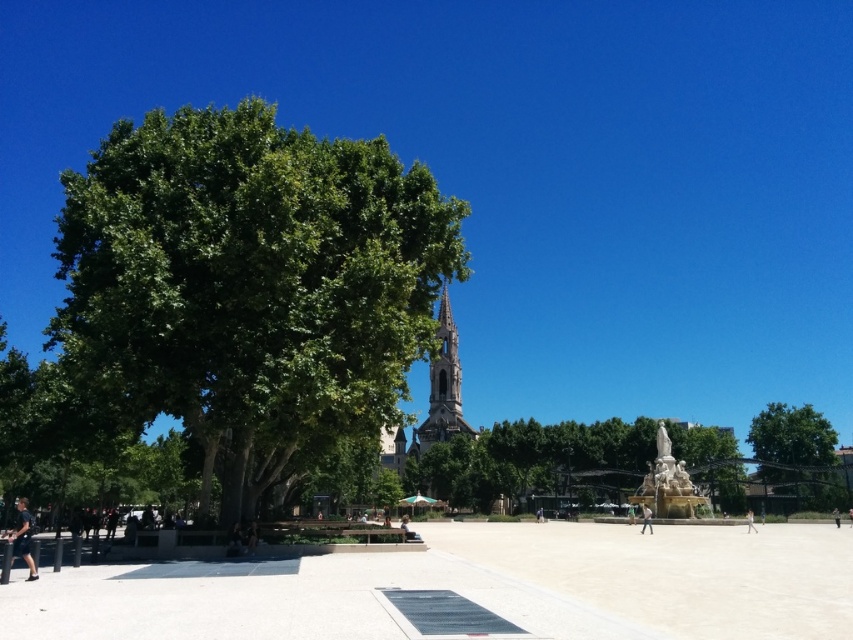
Question: Does green leafy tree at left appear on the left side of smooth stone tower at center?

Choices:
 (A) yes
 (B) no

Answer: (A)

Question: From the image, what is the correct spatial relationship of green leafy tree at center in relation to light brown wooden bench at center?

Choices:
 (A) left
 (B) right

Answer: (A)

Question: Can you confirm if green leafy tree at center is positioned to the right of camouflage fabric person at center?

Choices:
 (A) no
 (B) yes

Answer: (A)

Question: Which point is closer to the camera taking this photo?

Choices:
 (A) (840, 493)
 (B) (254, 538)

Answer: (B)

Question: Which object is farther from the camera taking this photo?

Choices:
 (A) green leafy tree at right
 (B) green leafy tree at center
 (C) smooth stone tower at center
 (D) green leafy tree at left

Answer: (A)

Question: Among these objects, which one is farthest from the camera?

Choices:
 (A) green leafy tree at right
 (B) green leafy tree at left
 (C) skinny jeans at lower right

Answer: (A)